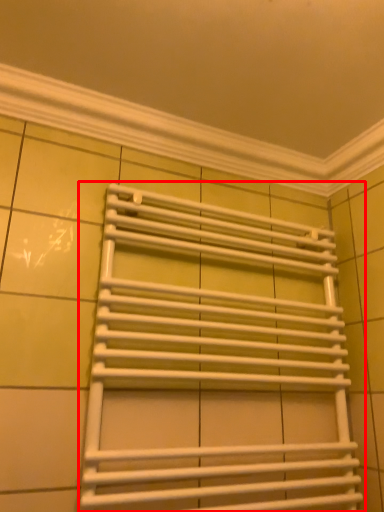
Question: From the image's perspective, considering the relative positions of towel rack (annotated by the red box) and window frame in the image provided, where is towel rack (annotated by the red box) located with respect to the staircase?

Choices:
 (A) above
 (B) below

Answer: (B)